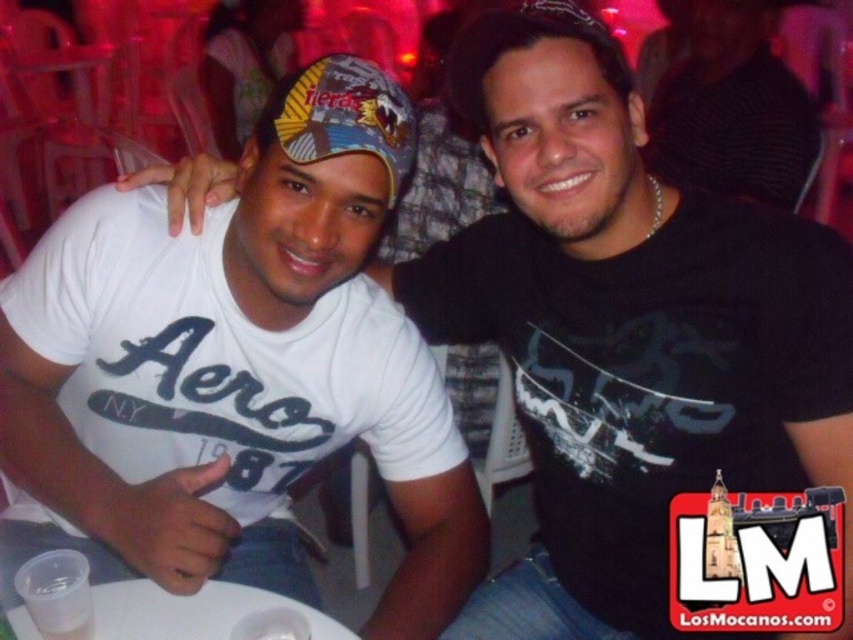
Between point (245, 544) and point (355, 148), which one is positioned in front?

Positioned in front is point (355, 148).

Looking at this image, is white matte t-shirt at left positioned at the back of multicolored fabric baseball cap at center?

That is True.

What do you see at coordinates (236, 369) in the screenshot? I see `white matte t-shirt at left` at bounding box center [236, 369].

Where is `white matte t-shirt at left`? The width and height of the screenshot is (853, 640). white matte t-shirt at left is located at coordinates (236, 369).

Can you confirm if white matte t-shirt at left is bigger than black knit cap at upper center?

No, white matte t-shirt at left is not bigger than black knit cap at upper center.

In the scene shown: Does white matte t-shirt at left appear on the left side of black knit cap at upper center?

Correct, you'll find white matte t-shirt at left to the left of black knit cap at upper center.

The width and height of the screenshot is (853, 640). Describe the element at coordinates (236, 369) in the screenshot. I see `white matte t-shirt at left` at that location.

The image size is (853, 640). What are the coordinates of `white matte t-shirt at left` in the screenshot? It's located at (236, 369).

Who is higher up, white matte t-shirt at left or white plastic table at lower center?

Positioned higher is white matte t-shirt at left.

Is point (169, 326) in front of point (137, 627)?

That is False.

Is point (476, 484) less distant than point (219, 616)?

That is False.

The width and height of the screenshot is (853, 640). Find the location of `white matte t-shirt at left`. white matte t-shirt at left is located at coordinates (236, 369).